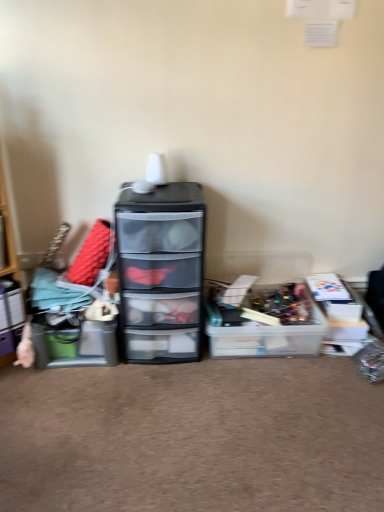
Question: Is wooden shelf at left a part of matte plastic storage box at left, the 2th storage box positioned from the left?

Choices:
 (A) no
 (B) yes

Answer: (A)

Question: Can you confirm if matte plastic storage box at left, the 2th storage box positioned from the right, is taller than wooden shelf at left?

Choices:
 (A) yes
 (B) no

Answer: (B)

Question: Is the depth of matte plastic storage box at left, the 2th storage box positioned from the right, less than that of wooden shelf at left?

Choices:
 (A) yes
 (B) no

Answer: (B)

Question: Considering the relative positions of matte plastic storage box at left, the 2th storage box positioned from the right, and wooden shelf at left in the image provided, is matte plastic storage box at left, the 2th storage box positioned from the right, to the left of wooden shelf at left from the viewer's perspective?

Choices:
 (A) no
 (B) yes

Answer: (A)

Question: Can you confirm if matte plastic storage box at left, the 2th storage box positioned from the right, is bigger than wooden shelf at left?

Choices:
 (A) yes
 (B) no

Answer: (B)

Question: Considering the positions of translucent plastic storage box at center, positioned as the third storage box in left-to-right order, and wooden shelf at left in the image, is translucent plastic storage box at center, positioned as the third storage box in left-to-right order, wider or thinner than wooden shelf at left?

Choices:
 (A) wide
 (B) thin

Answer: (A)

Question: Based on their sizes in the image, would you say translucent plastic storage box at center, positioned as the third storage box in left-to-right order, is bigger or smaller than wooden shelf at left?

Choices:
 (A) small
 (B) big

Answer: (A)

Question: Is translucent plastic storage box at center, positioned as the third storage box in left-to-right order, situated inside wooden shelf at left or outside?

Choices:
 (A) inside
 (B) outside

Answer: (B)

Question: From a real-world perspective, is translucent plastic storage box at center, positioned as the third storage box in left-to-right order, above or below wooden shelf at left?

Choices:
 (A) below
 (B) above

Answer: (A)

Question: Would you say wooden shelf at left is inside or outside matte plastic storage box at left, which is the 1th storage box from left to right?

Choices:
 (A) outside
 (B) inside

Answer: (A)

Question: From a real-world perspective, is wooden shelf at left above or below matte plastic storage box at left, the third storage box viewed from the right?

Choices:
 (A) below
 (B) above

Answer: (B)

Question: In the image, is wooden shelf at left on the left side or the right side of matte plastic storage box at left, which is the 1th storage box from left to right?

Choices:
 (A) right
 (B) left

Answer: (B)

Question: Is wooden shelf at left wider or thinner than matte plastic storage box at left, which is the 1th storage box from left to right?

Choices:
 (A) wide
 (B) thin

Answer: (A)

Question: Is transparent plastic chest of drawers at center bigger or smaller than matte plastic storage box at left, which is the 1th storage box from left to right?

Choices:
 (A) big
 (B) small

Answer: (A)

Question: Considering the positions of transparent plastic chest of drawers at center and matte plastic storage box at left, the third storage box viewed from the right, in the image, is transparent plastic chest of drawers at center wider or thinner than matte plastic storage box at left, the third storage box viewed from the right,?

Choices:
 (A) wide
 (B) thin

Answer: (A)